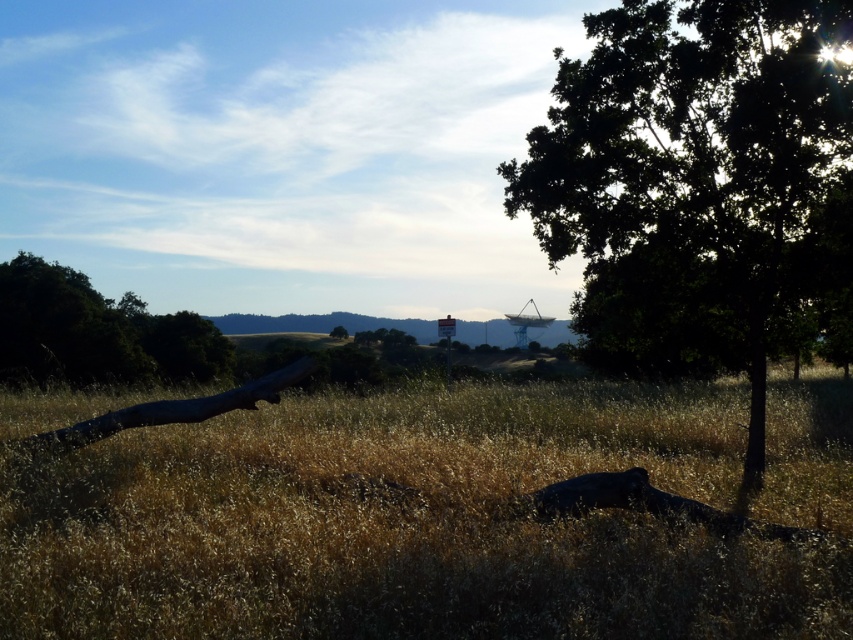
Question: Is dry grass at center to the left of green leafy tree at left from the viewer's perspective?

Choices:
 (A) no
 (B) yes

Answer: (A)

Question: Considering the real-world distances, which object is closest to the dry grass at center?

Choices:
 (A) green matte tree at center
 (B) green leafy tree at left
 (C) green leafy tree at center

Answer: (C)

Question: Which of the following is the closest to the observer?

Choices:
 (A) green leafy tree at center
 (B) green leafy tree at left
 (C) dry grass at center

Answer: (C)

Question: Estimate the real-world distances between objects in this image. Which object is farther from the green leafy tree at left?

Choices:
 (A) green leafy tree at center
 (B) dry grass at center

Answer: (A)

Question: Is green leafy tree at center positioned at the back of green matte tree at center?

Choices:
 (A) no
 (B) yes

Answer: (A)

Question: Is green leafy tree at center above green matte tree at center?

Choices:
 (A) yes
 (B) no

Answer: (A)